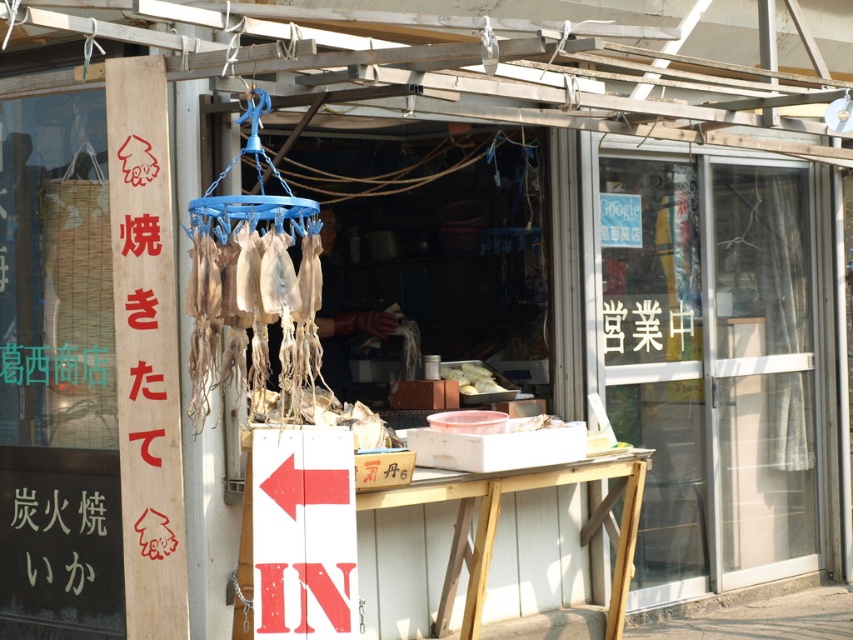
Who is more forward, (x=312, y=490) or (x=219, y=253)?

Point (x=219, y=253) is more forward.

Does red wooden sign at lower left have a greater width compared to dried beige squid at center?

No.

You are a GUI agent. You are given a task and a screenshot of the screen. Output one action in this format:
    pyautogui.click(x=<x>, y=<y>)
    Task: Click on the red wooden sign at lower left
    This screenshot has height=640, width=853.
    Given the screenshot: What is the action you would take?
    pyautogui.click(x=303, y=532)

Where is `red wooden sign at lower left`? red wooden sign at lower left is located at coordinates tap(303, 532).

Who is taller, transparent glass door at center or dried beige squid at center?

transparent glass door at center is taller.

Which is behind, point (729, 586) or point (219, 340)?

Positioned behind is point (729, 586).

The height and width of the screenshot is (640, 853). What are the coordinates of `transparent glass door at center` in the screenshot? It's located at (711, 364).

Can you confirm if dried beige squid at center is smaller than white matte food at center?

Actually, dried beige squid at center might be larger than white matte food at center.

Find the location of a particular element. This screenshot has width=853, height=640. dried beige squid at center is located at coordinates (252, 312).

The image size is (853, 640). I want to click on dried beige squid at center, so click(x=252, y=312).